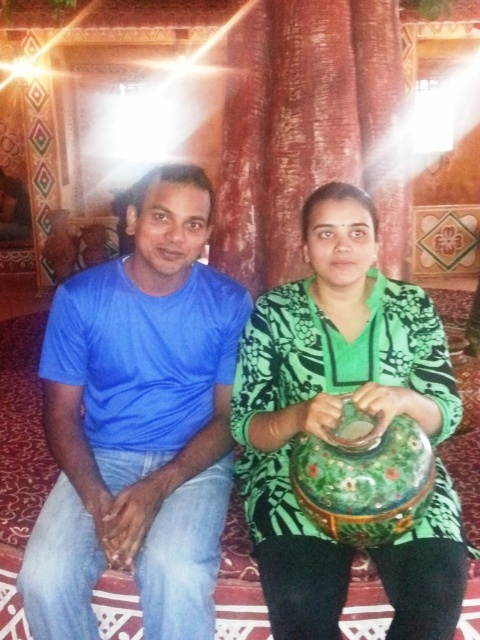
Is blue cotton shirt at left above green floral dress at center?

Indeed, blue cotton shirt at left is positioned over green floral dress at center.

Is blue cotton shirt at left to the right of green floral dress at center from the viewer's perspective?

Incorrect, blue cotton shirt at left is not on the right side of green floral dress at center.

Where is `blue cotton shirt at left`? The height and width of the screenshot is (640, 480). blue cotton shirt at left is located at coordinates (139, 422).